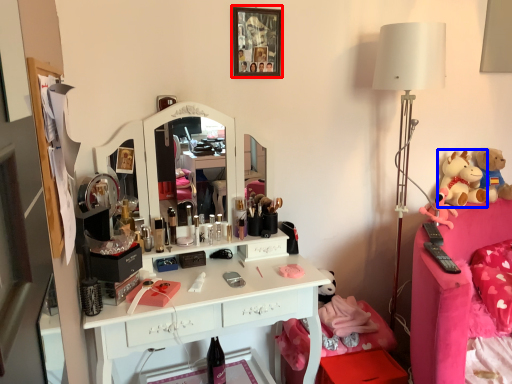
Question: Which point is closer to the camera, picture frame (highlighted by a red box) or toy (highlighted by a blue box)?

Choices:
 (A) picture frame
 (B) toy

Answer: (A)